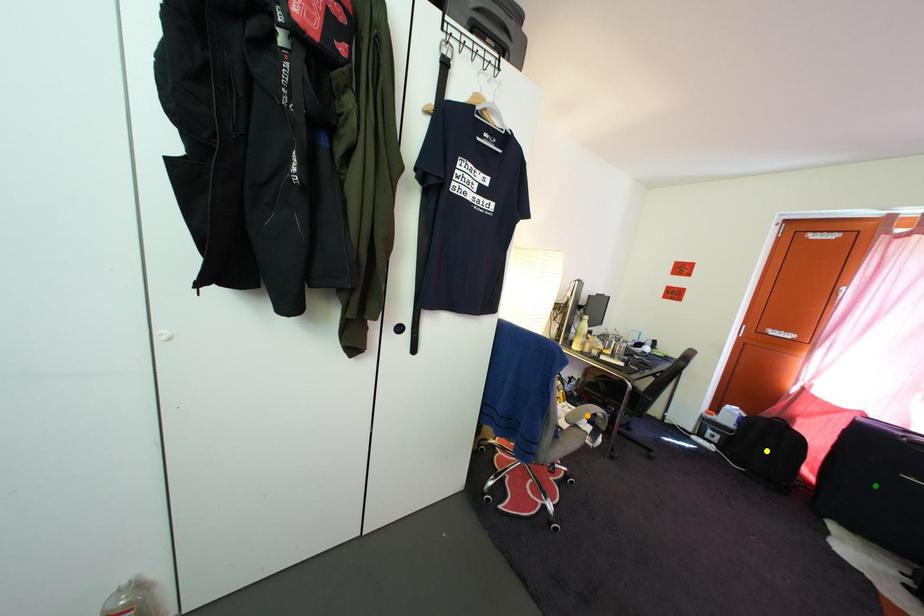
Order these from nearest to farthest:
orange point
yellow point
green point

green point < yellow point < orange point